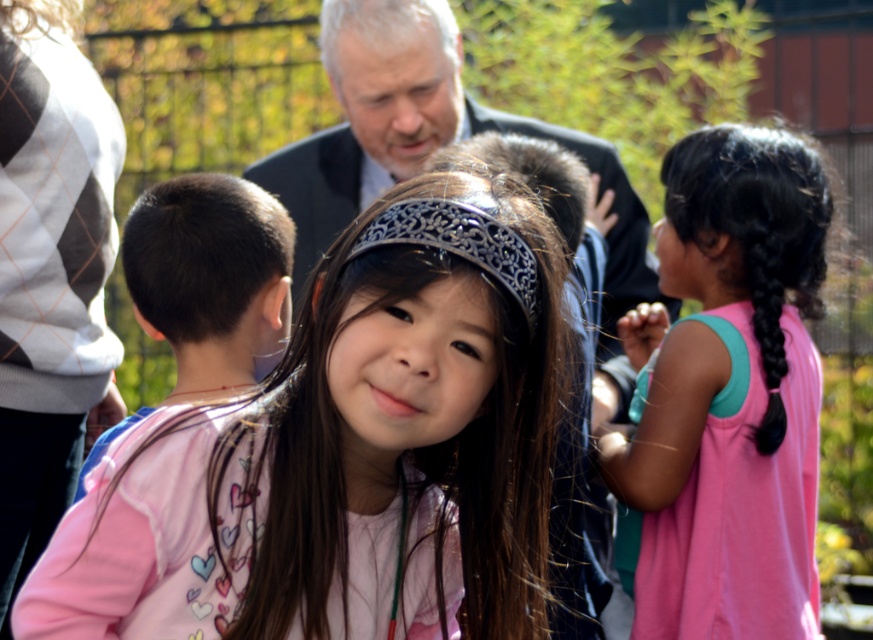
You are a photographer trying to capture a clear shot of both the metallic silver headscarf at center and the gray matte hair at upper center. Which object should you focus on first to ensure it appears sharp in the photo?

You should focus on the metallic silver headscarf at center first because it is closer to the viewer than the gray matte hair at upper center. By focusing on the closer object, you can ensure it remains sharp while the background object may appear slightly blurred, but this is typical in such compositions.

In the scene, you see a pink fabric at center and black silky hair at right. Which object is positioned lower in the image?

The pink fabric at center is positioned below black silky hair at right, so the pink fabric at center is lower in the image.